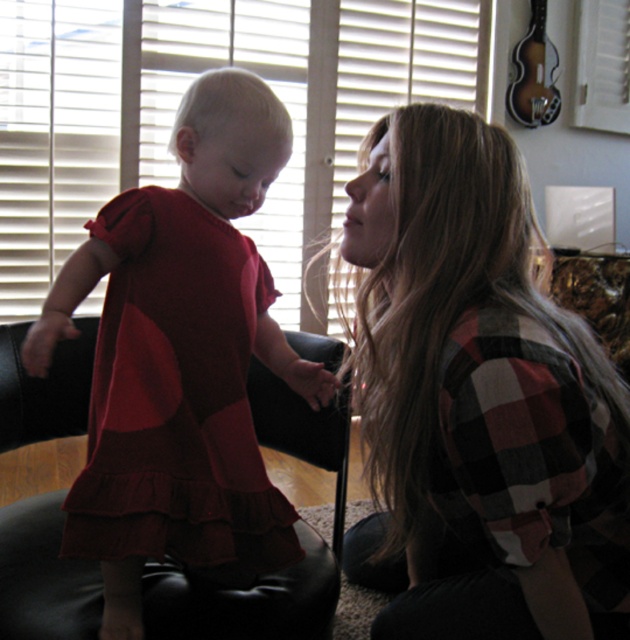
You are a tailor who needs to determine which item requires more fabric for alterations. Given the plaid flannel shirt at center and the matte red dress at left, which one would need more fabric due to its thickness?

The plaid flannel shirt at center is thinner than the matte red dress at left, so the dress would require more fabric for alterations because it is thicker.

Please look at the image and locate the point at coordinates (181, 358). What object is positioned at that exact point?

The matte red dress at left is located at point (181, 358).

You are standing in the living room and want to place a small decorative item exactly between the plaid flannel shirt at center and the edge of the black leather ottoman. Which object should you use as a reference point to ensure proper placement?

The plaid flannel shirt at center is located at point [476,401], so you should use its coordinates as the reference point to determine the midpoint between it and the edge of the black leather ottoman.